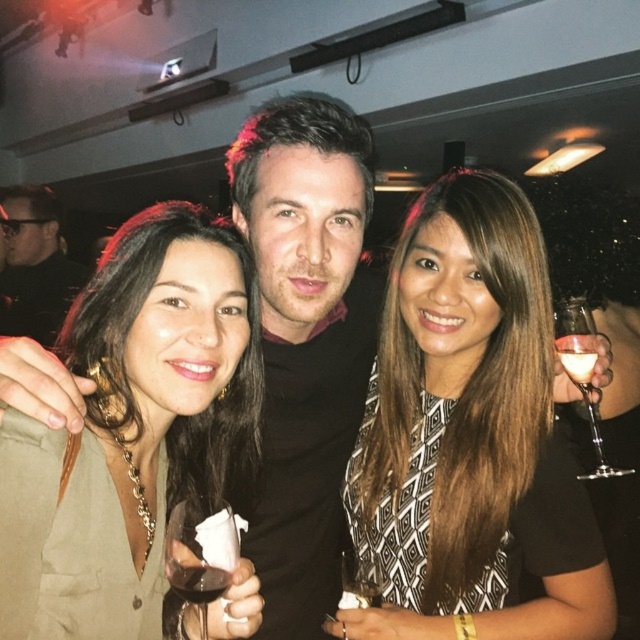
You are at a party and want to place a small decoration exactly at the point with coordinates point (358, 580). Which object in the scene is located at that point?

The point (358, 580) is located on the clear glass wine at center.

You are a bartender at the party and need to place two wine glasses on the table. The clear glass wine at center and the translucent glass wine at center must be placed exactly 14 inches apart. Can you position them correctly?

The distance between the clear glass wine at center and the translucent glass wine at center is 13.56 inches, which is slightly less than the required 14 inches. You need to move them slightly further apart to meet the requirement.

You are a photographer at the event and want to capture a photo that includes both the matte olive green dress at center and the black matte jacket at upper left. Given their sizes, which object should you frame first to ensure both fit in the shot?

The matte olive green dress at center is wider than the black matte jacket at upper left, so you should frame the matte olive green dress at center first to accommodate its larger width, then adjust to include the black matte jacket at upper left.